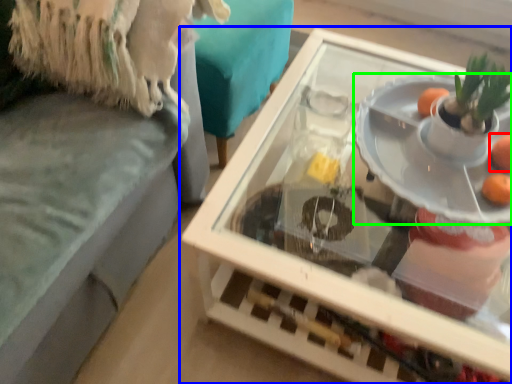
Question: Estimate the real-world distances between objects in this image. Which object is farther from orange (highlighted by a red box), table (highlighted by a blue box) or plate (highlighted by a green box)?

Choices:
 (A) table
 (B) plate

Answer: (A)